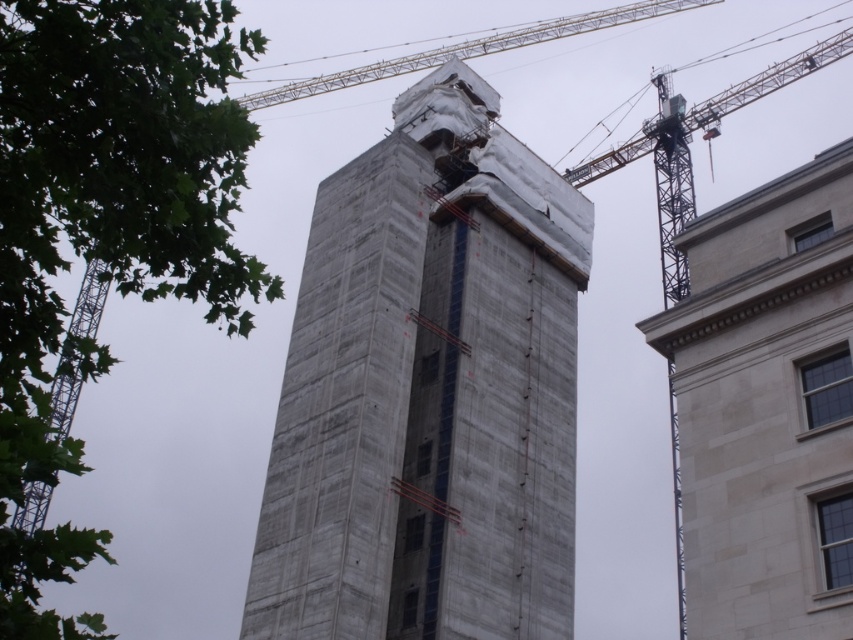
You are standing at the origin point in the image. Which direction should you move to reach the concrete tower at center?

The concrete tower at center is located at point 0.611 on the x axis and 0.503 on the y axis. Since the origin is at the bottom left corner, moving towards the right and slightly upwards will lead you to the concrete tower at center.

You are a crane operator needing to move a heavy beam from the concrete tower at center to the light gray stone building at right. The beam is 30 meters long. Can the beam be safely lowered between the two structures without touching either?

The distance between the concrete tower at center and the light gray stone building at right is 29.25 meters. Since the beam is 30 meters long, it cannot be safely lowered between them without touching the structures.